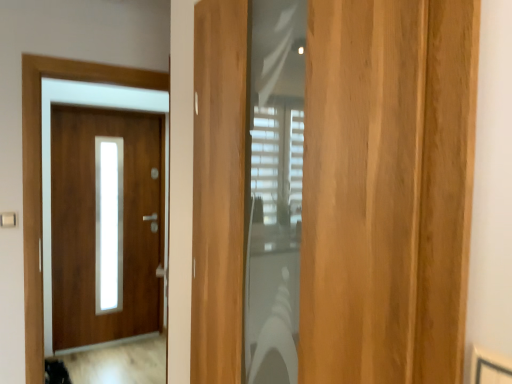
Question: Based on their sizes in the image, would you say light brown wood door at center, which ranks as the second door in left-to-right order, is bigger or smaller than matte wood door at left, which is the second door in right-to-left order?

Choices:
 (A) small
 (B) big

Answer: (A)

Question: From a real-world perspective, is light brown wood door at center, the first door in the right-to-left sequence, physically located above or below matte wood door at left, which is the second door in right-to-left order?

Choices:
 (A) below
 (B) above

Answer: (B)

Question: Relative to matte wood door at left, acting as the second door starting from the front, is light brown wood door at center, which is the first door in front-to-back order, in front or behind?

Choices:
 (A) behind
 (B) front

Answer: (B)

Question: Is matte wood door at left, placed as the 1th door when sorted from back to front, inside or outside of light brown wood door at center, the 2th door when ordered from back to front?

Choices:
 (A) outside
 (B) inside

Answer: (A)

Question: Is point (106, 317) closer or farther from the camera than point (360, 51)?

Choices:
 (A) farther
 (B) closer

Answer: (A)

Question: In the image, is matte wood door at left, acting as the second door starting from the front, positioned in front of or behind light brown wood door at center, which is the first door in front-to-back order?

Choices:
 (A) front
 (B) behind

Answer: (B)

Question: Considering the positions of matte wood door at left, marked as the 1th door in a left-to-right arrangement, and light brown wood door at center, which is the first door in front-to-back order, in the image, is matte wood door at left, marked as the 1th door in a left-to-right arrangement, wider or thinner than light brown wood door at center, which is the first door in front-to-back order,?

Choices:
 (A) wide
 (B) thin

Answer: (B)